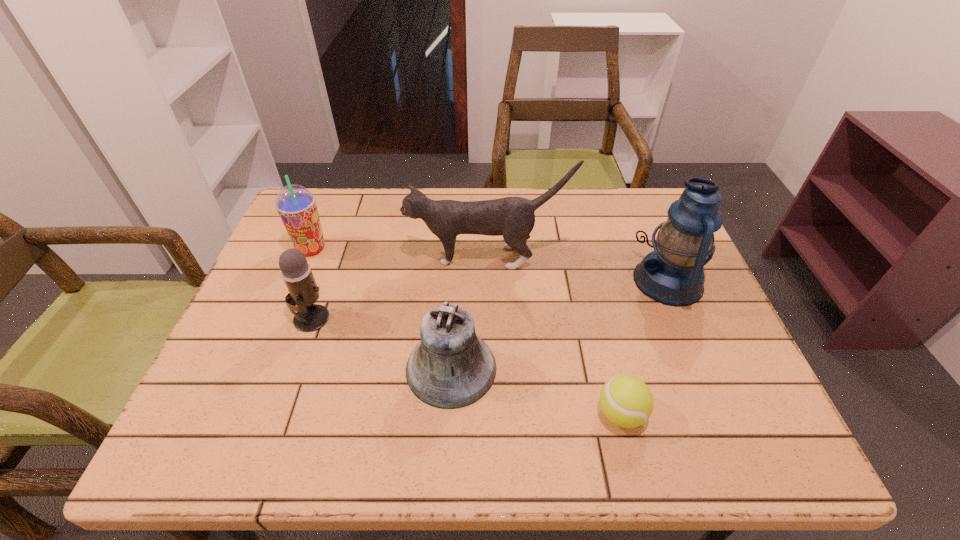
Identify the location of vacant space located 0.050m on the face of the rightmost object. The height and width of the screenshot is (540, 960). (614, 281).

Identify the location of free space located 0.290m on the face of the rightmost object. (521, 281).

Locate an element on the screen. The height and width of the screenshot is (540, 960). free region located on the right of the smoothie is located at coordinates (426, 248).

This screenshot has width=960, height=540. Find the location of `vacant space located on the right of the microphone`. vacant space located on the right of the microphone is located at coordinates (380, 318).

Identify the location of vacant region located 0.310m on the left of the bell. The height and width of the screenshot is (540, 960). (262, 368).

This screenshot has height=540, width=960. What are the coordinates of `vacant space situated 0.060m on the left of the shortest object` in the screenshot? It's located at (565, 414).

Find the location of `object present at the near edge`. object present at the near edge is located at coordinates (625, 400).

In order to click on smoothie at the left edge in this screenshot , I will do `click(296, 205)`.

The image size is (960, 540). Find the location of `microphone that is at the left edge`. microphone that is at the left edge is located at coordinates (303, 291).

This screenshot has width=960, height=540. I want to click on object located in the right edge section of the desktop, so click(x=672, y=274).